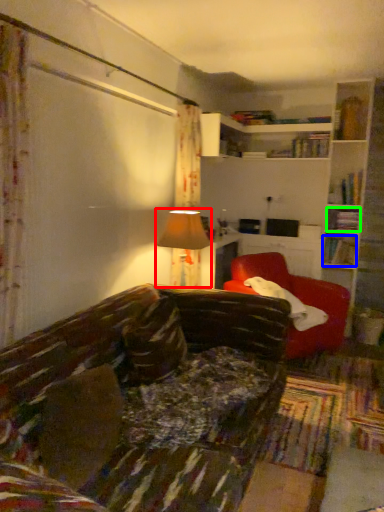
Question: Considering the real-world distances, which object is closest to table lamp (highlighted by a red box)? book (highlighted by a blue box) or book (highlighted by a green box).

Choices:
 (A) book
 (B) book

Answer: (A)